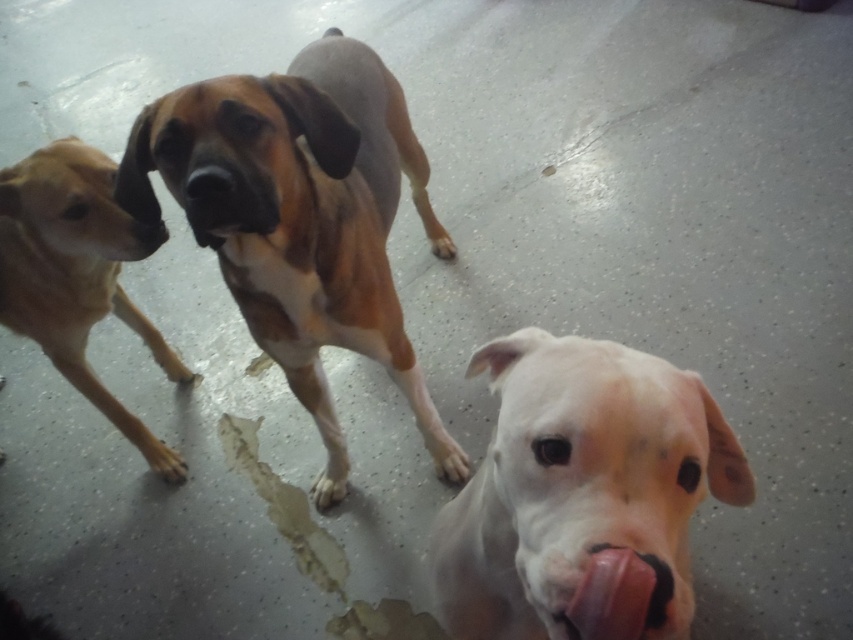
You are a veterinarian examining two dogs in an indoor setting. The dogs are standing on a glossy floor with water stains. You notice the black smooth nose at center and the brown matte nose at center. Which nose is positioned higher on the dogs?

The black smooth nose at center is positioned higher than the brown matte nose at center.

You are a veterinarian examining two dogs in an indoor setting. The dogs are standing on a glossy floor with water stains. You notice the black smooth nose at center and the brown matte nose at center. Which nose is smaller in size?

The black smooth nose at center is smaller in size compared to the brown matte nose at center.